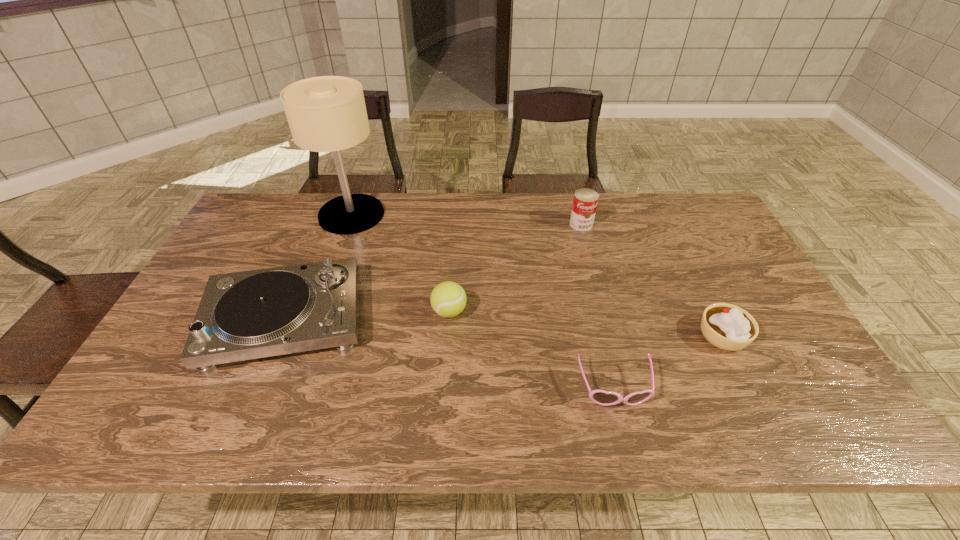
At what (x,y) coordinates should I click in order to perform the action: click on vacant space at the far left corner of the desktop. Please return your answer as a coordinate pair (x, y). Looking at the image, I should click on (259, 226).

Locate an element on the screen. free space between the tallest object and the third object from left to right is located at coordinates (x=400, y=263).

At what (x,y) coordinates should I click in order to perform the action: click on vacant space in between the record player and the fifth shortest object. Please return your answer as a coordinate pair (x, y). This screenshot has height=540, width=960. Looking at the image, I should click on (433, 272).

Find the location of a particular element. The image size is (960, 540). free spot between the can and the table lamp is located at coordinates (467, 219).

Identify the location of blank region between the tennis ball and the fifth shortest object. The width and height of the screenshot is (960, 540). (516, 268).

The height and width of the screenshot is (540, 960). I want to click on empty space between the can and the whipped cream, so click(x=652, y=280).

Where is `vacant area that lies between the can and the shortest object`? vacant area that lies between the can and the shortest object is located at coordinates (597, 306).

The height and width of the screenshot is (540, 960). Identify the location of free space between the whipped cream and the tallest object. (538, 275).

Where is `empty space between the shortest object and the table lamp`? The image size is (960, 540). empty space between the shortest object and the table lamp is located at coordinates (483, 301).

Identify the location of vacant space that is in between the sunglasses and the second tallest object. Image resolution: width=960 pixels, height=540 pixels. (597, 306).